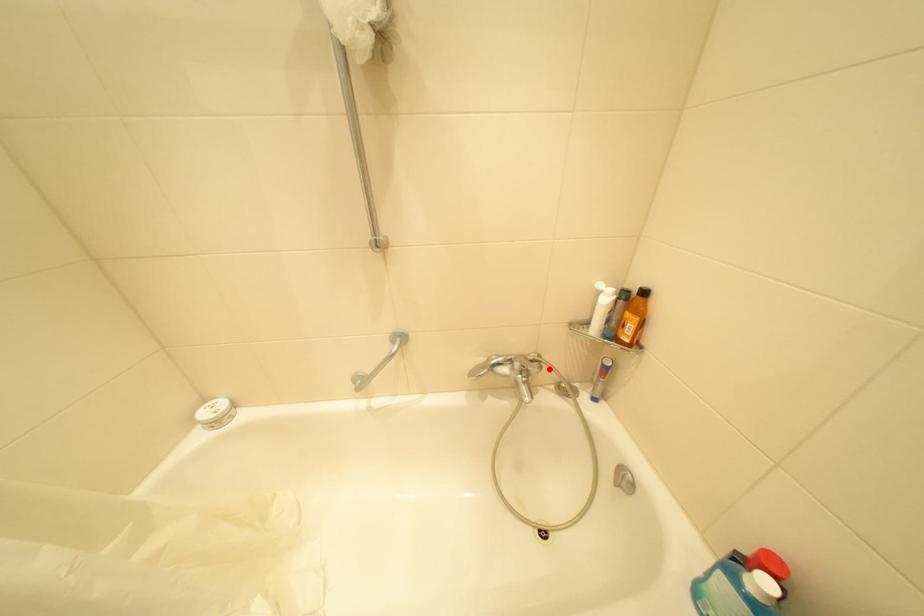
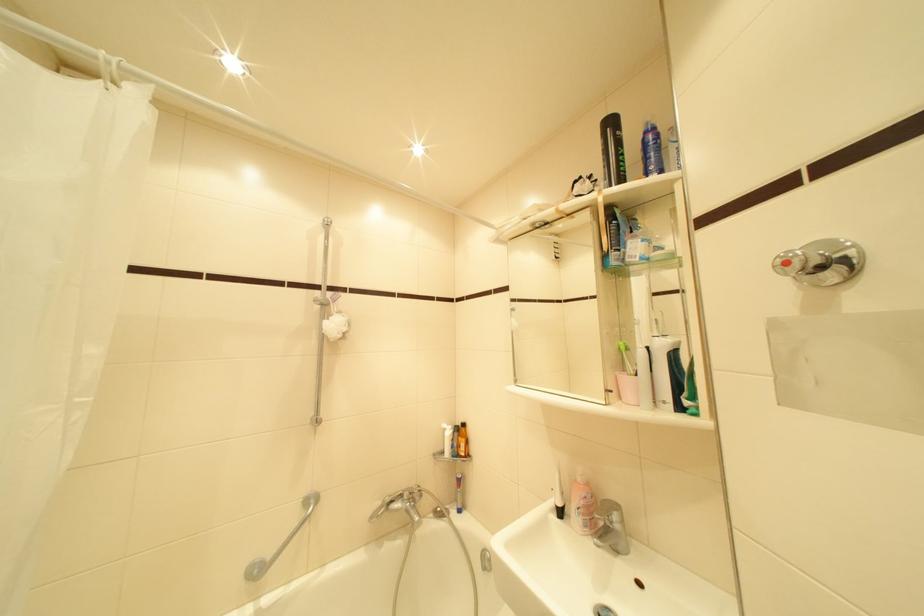
Where in the second image is the point corresponding to the highlighted location from the first image?

(430, 496)